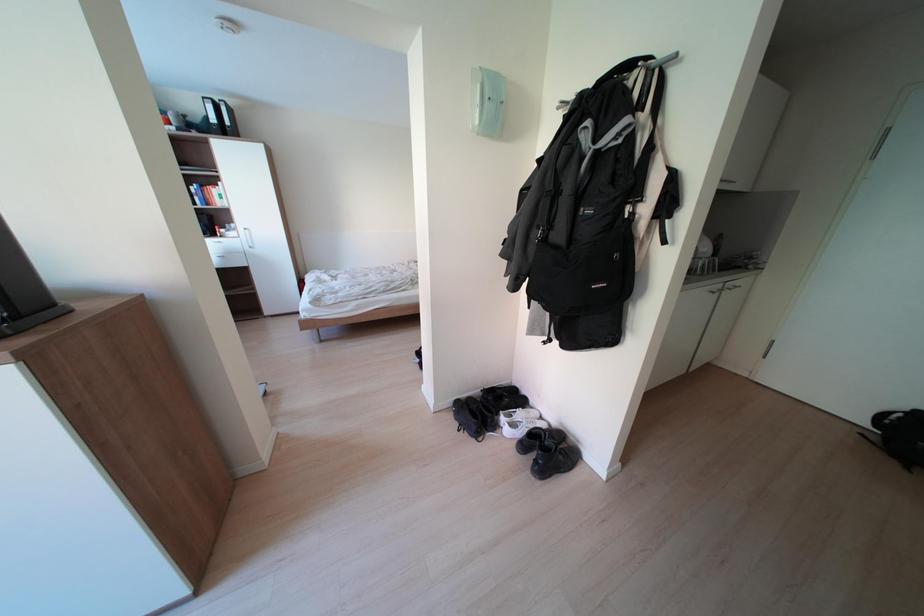
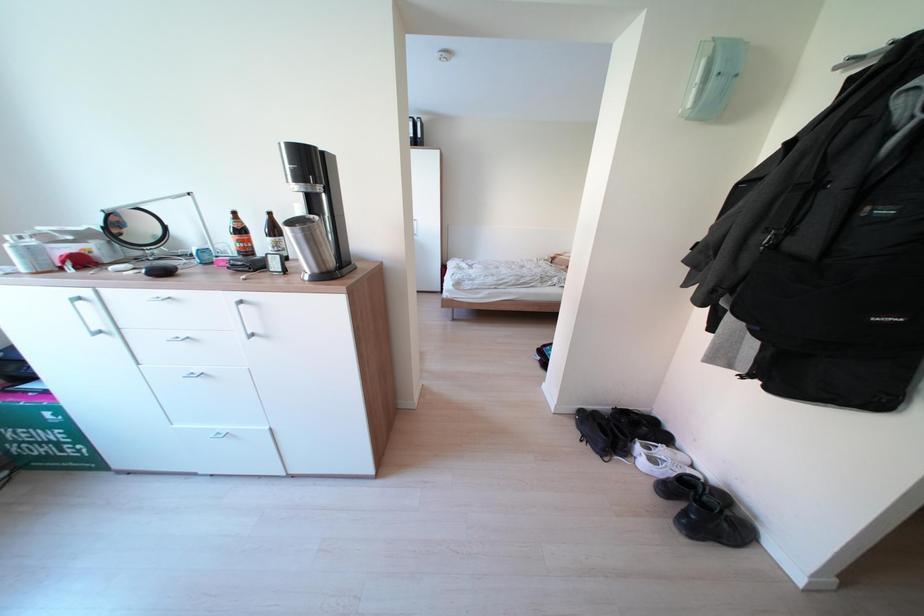
Question: The first image is from the beginning of the video and the second image is from the end. How did the camera likely rotate when shooting the video?

Choices:
 (A) Left
 (B) Right
 (C) Up
 (D) Down

Answer: (A)